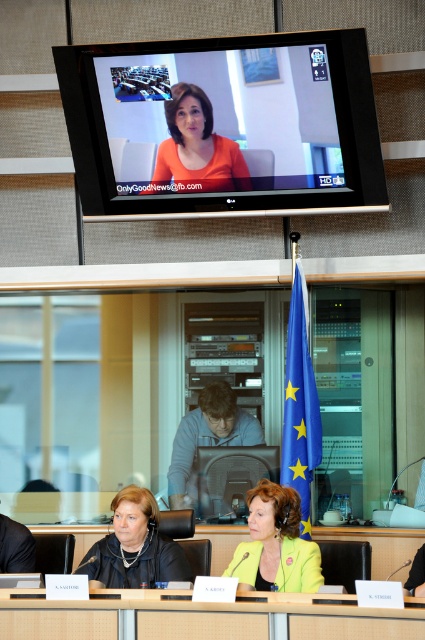
Can you confirm if matte black monitor at upper center is positioned above matte black chair at lower left?

Yes.

Is point (286, 99) less distant than point (0, 544)?

No, it is behind (0, 544).

The width and height of the screenshot is (425, 640). Identify the location of matte black monitor at upper center. (221, 120).

Between matte black monitor at upper center and yellow fabric jacket at lower center, which one has less height?

With less height is yellow fabric jacket at lower center.

Is point (116, 67) positioned in front of point (291, 579)?

That is False.

Where is `matte black monitor at upper center`? The height and width of the screenshot is (640, 425). matte black monitor at upper center is located at coordinates (221, 120).

Between orange matte shirt at upper center and matte black chair at lower left, which one is positioned lower?

Positioned lower is matte black chair at lower left.

Can you confirm if orange matte shirt at upper center is thinner than matte black chair at lower left?

In fact, orange matte shirt at upper center might be wider than matte black chair at lower left.

Locate an element on the screen. This screenshot has height=640, width=425. orange matte shirt at upper center is located at coordinates click(195, 148).